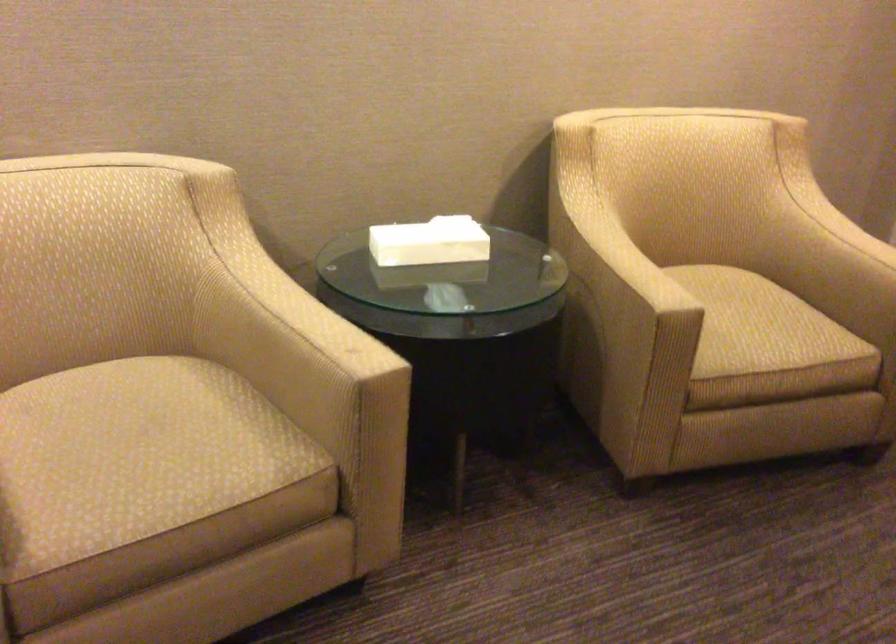
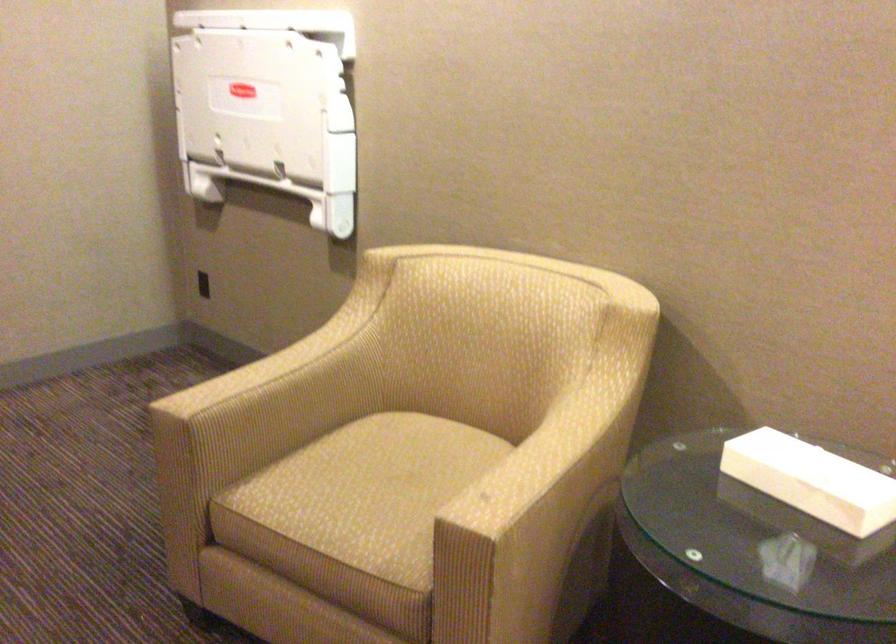
The point at (452, 242) is marked in the first image. Where is the corresponding point in the second image?

(812, 480)